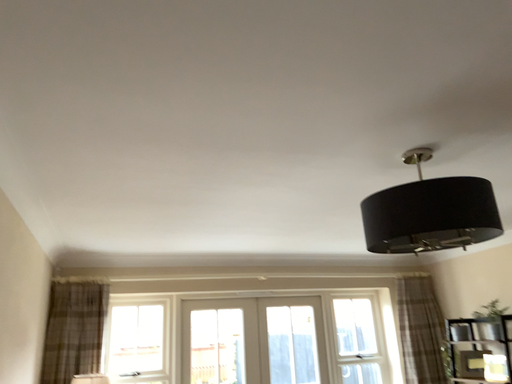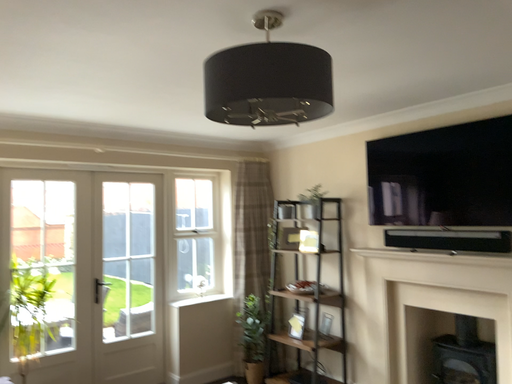
Question: How did the camera likely rotate when shooting the video?

Choices:
 (A) rotated downward
 (B) rotated upward

Answer: (A)